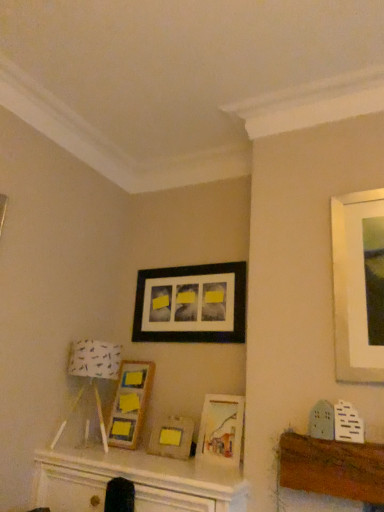
Locate an element on the screen. This screenshot has width=384, height=512. free space above black matte picture frame at upper center, which ranks as the 1th picture frame in top-to-bottom order (from a real-world perspective) is located at coordinates (206, 259).